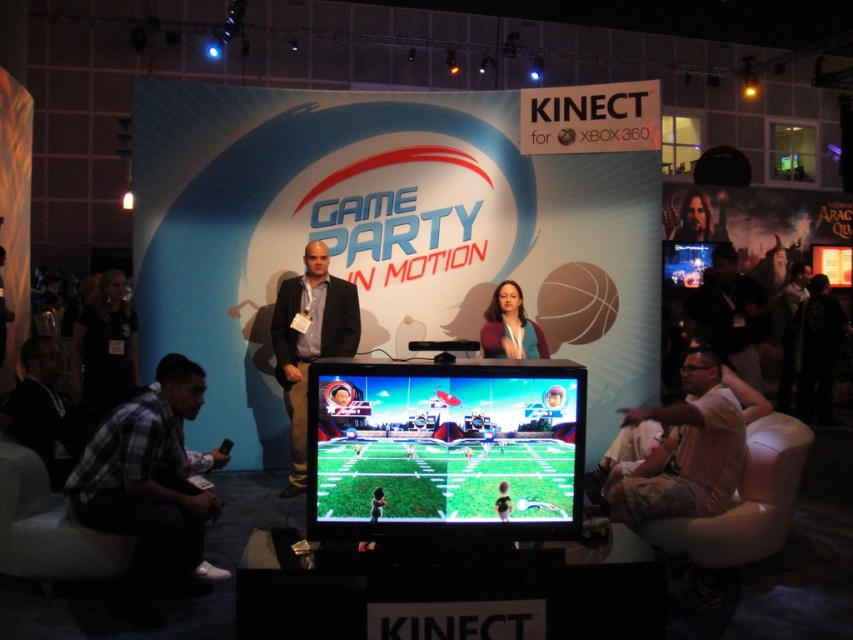
Question: Based on their relative distances, which object is farther from the smooth skin face at upper right?

Choices:
 (A) dark gray shirt at right
 (B) matte black suit at center
 (C) flat screen tv at center

Answer: (C)

Question: Among these objects, which one is farthest from the camera?

Choices:
 (A) smooth skin face at upper right
 (B) plaid shirt at lower left
 (C) shiny blue screen at upper right

Answer: (A)

Question: Does matte black suit at center have a larger size compared to dark gray shirt at right?

Choices:
 (A) yes
 (B) no

Answer: (B)

Question: Is matte black suit at center positioned at the back of shiny blue screen at upper right?

Choices:
 (A) yes
 (B) no

Answer: (B)

Question: Which of these objects is positioned farthest from the shiny blue screen at upper right?

Choices:
 (A) white cotton shirt at right
 (B) matte blue shirt at center
 (C) matte black suit at center
 (D) plaid shirt at lower left

Answer: (D)

Question: Does matte black suit at center have a lesser width compared to shiny blue screen at upper right?

Choices:
 (A) yes
 (B) no

Answer: (A)